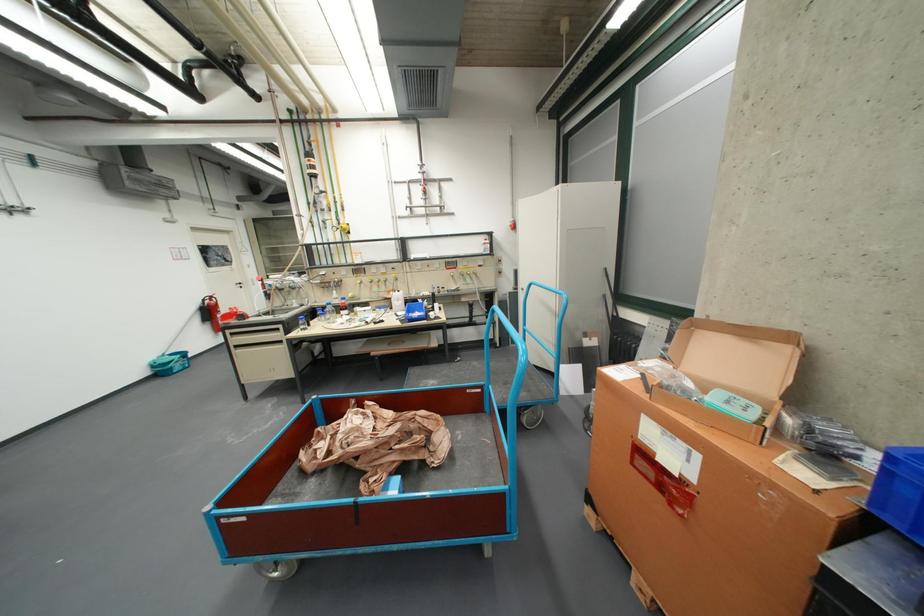
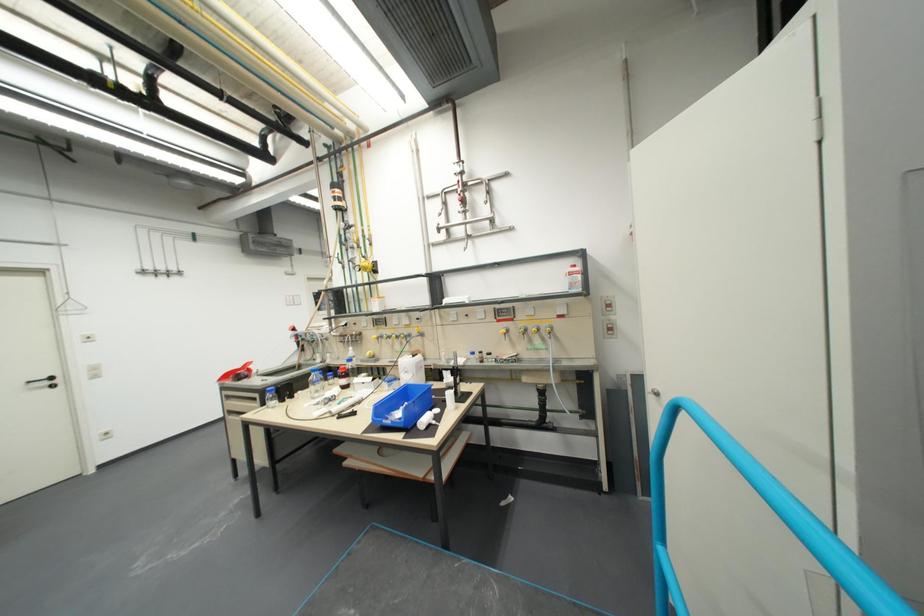
Where in the second image is the point corresponding to the point at 345,237 from the first image?

(373, 278)